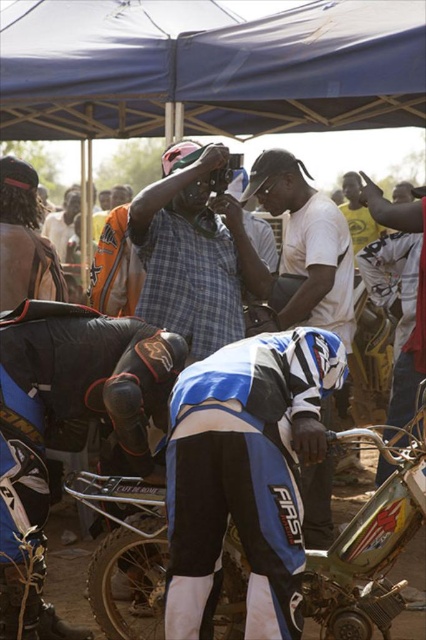
Question: Does black matte motorcycle at lower left have a smaller size compared to plaid fabric shirt at center?

Choices:
 (A) yes
 (B) no

Answer: (A)

Question: Which object is farther from the camera taking this photo?

Choices:
 (A) blue/white/striped motorcycle pants at center
 (B) metallic silver motorcycle at lower center

Answer: (B)

Question: Which of the following is the farthest from the observer?

Choices:
 (A) black matte motorcycle at lower left
 (B) metallic silver motorcycle at lower center
 (C) blue/white/striped motorcycle pants at center

Answer: (A)

Question: Is metallic silver motorcycle at lower center closer to the viewer compared to white matte shirt at center?

Choices:
 (A) yes
 (B) no

Answer: (A)

Question: Does metallic silver motorcycle at lower center have a larger size compared to plaid fabric shirt at center?

Choices:
 (A) yes
 (B) no

Answer: (B)

Question: Among these objects, which one is farthest from the camera?

Choices:
 (A) black matte motorcycle at lower left
 (B) blue/white/striped motorcycle pants at center
 (C) plaid fabric shirt at center
 (D) metallic silver motorcycle at lower center

Answer: (C)